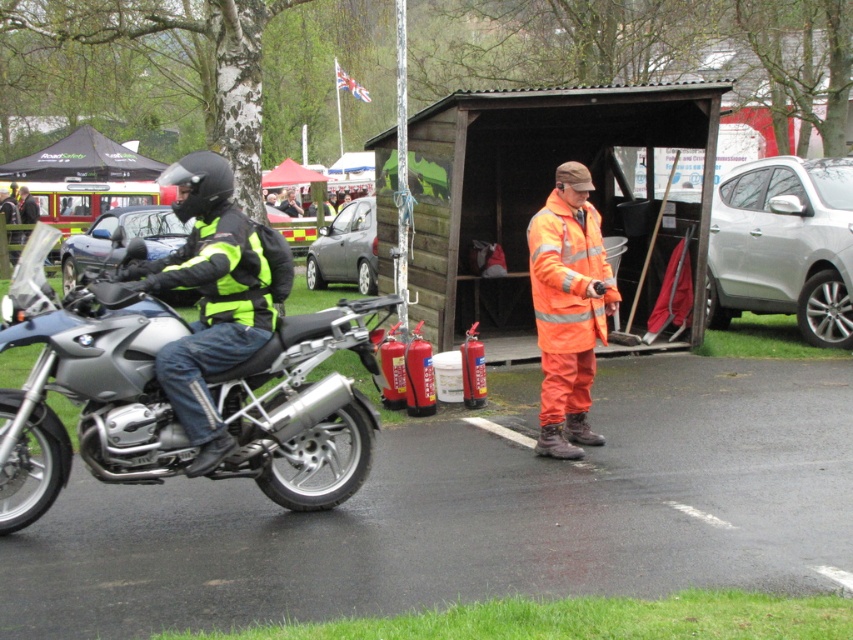
Is point (231, 412) behind point (68, 273)?

No, it is in front of (68, 273).

Is silver metallic motorcycle at left bigger than silver metallic car at center?

Incorrect, silver metallic motorcycle at left is not larger than silver metallic car at center.

Describe the element at coordinates (83, 388) in the screenshot. The image size is (853, 640). I see `silver metallic motorcycle at left` at that location.

The width and height of the screenshot is (853, 640). Identify the location of silver metallic motorcycle at left. (83, 388).

Based on the photo, can you confirm if silver metallic car at right is positioned above orange reflective suit at center?

Yes.

This screenshot has width=853, height=640. In order to click on silver metallic car at right in this screenshot , I will do `click(784, 244)`.

Looking at this image, measure the distance between matte black motorcycle at left and silver metallic car at center.

matte black motorcycle at left and silver metallic car at center are 10.85 meters apart from each other.

Who is lower down, matte black motorcycle at left or silver metallic car at center?

silver metallic car at center is below.

Between point (289, 285) and point (111, 244), which one is positioned in front?

Point (289, 285) is in front.

Locate an element on the screen. matte black motorcycle at left is located at coordinates (213, 296).